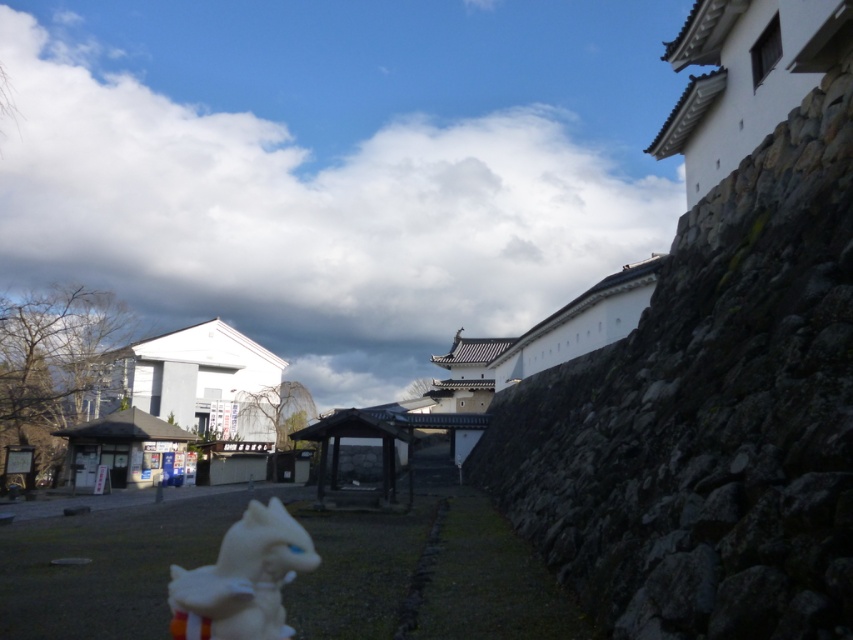
Question: Does white fluffy cloud at upper center appear over white plush toy at lower center?

Choices:
 (A) yes
 (B) no

Answer: (A)

Question: Can you confirm if white fluffy cloud at upper center is positioned below white plush toy at lower center?

Choices:
 (A) no
 (B) yes

Answer: (A)

Question: Which point is farther to the camera?

Choices:
 (A) (350, 236)
 (B) (268, 582)

Answer: (A)

Question: From the image, what is the correct spatial relationship of white fluffy cloud at upper center in relation to white plush toy at lower center?

Choices:
 (A) above
 (B) below

Answer: (A)

Question: Which point is closer to the camera taking this photo?

Choices:
 (A) (635, 80)
 (B) (225, 557)

Answer: (B)